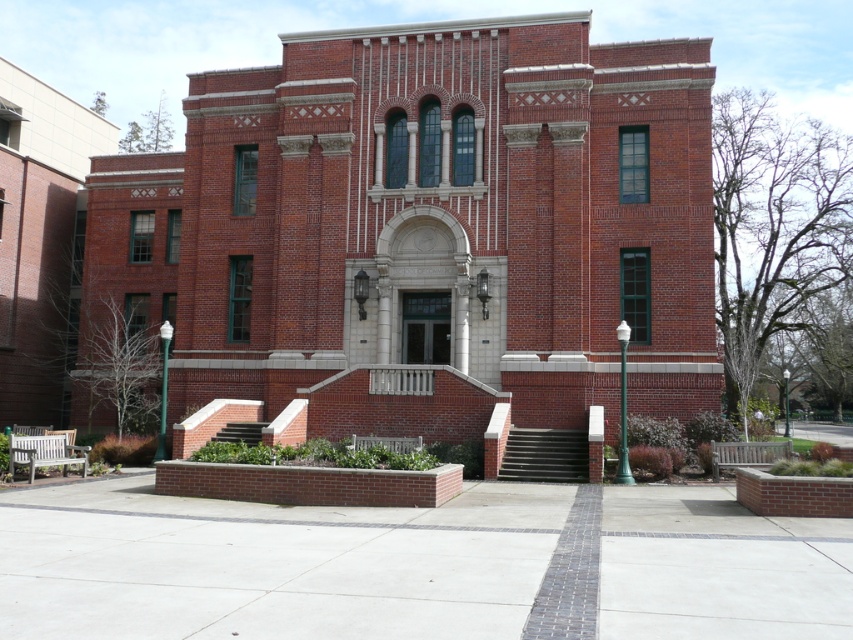
You are a visitor approaching the building and want to reach the entrance. You notice the green metal lamp post at center and the brown brick stairs at center. Which object is closer to the entrance?

The brown brick stairs at center are closer to the entrance because the green metal lamp post at center is to the right of the stairs, implying the stairs are directly in front of the entrance leading up to it.